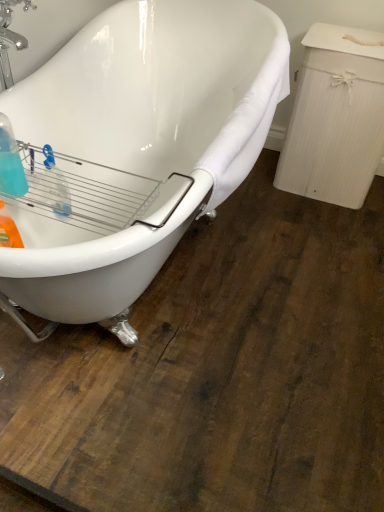
What do you see at coordinates (10, 161) in the screenshot? The image size is (384, 512). I see `translucent plastic bottle at left` at bounding box center [10, 161].

The height and width of the screenshot is (512, 384). What are the coordinates of `translucent plastic bottle at left` in the screenshot? It's located at (10, 161).

Measure the distance between point (24, 186) and camera.

Point (24, 186) is 3.46 feet away from camera.

Describe the element at coordinates (133, 150) in the screenshot. I see `white glossy bathtub at upper left` at that location.

Find the location of a particular element. The image size is (384, 512). white glossy bathtub at upper left is located at coordinates (133, 150).

At what (x,y) coordinates should I click in order to perform the action: click on translucent plastic bottle at left. Please return your answer as a coordinate pair (x, y). The image size is (384, 512). Looking at the image, I should click on pos(10,161).

Can you confirm if white glossy bathtub at upper left is positioned to the right of translucent plastic bottle at left?

Indeed, white glossy bathtub at upper left is positioned on the right side of translucent plastic bottle at left.

Which object is further away from the camera, white glossy bathtub at upper left or translucent plastic bottle at left?

translucent plastic bottle at left is further away from the camera.

Considering the points (188, 59) and (6, 157), which point is in front, point (188, 59) or point (6, 157)?

The point (6, 157) is closer.

From the image's perspective, which is below, white glossy bathtub at upper left or translucent plastic bottle at left?

translucent plastic bottle at left, from the image's perspective.

From a real-world perspective, relative to translucent plastic bottle at left, is white glossy bathtub at upper left vertically above or below?

In terms of real-world spatial position, white glossy bathtub at upper left is below translucent plastic bottle at left.

Is white glossy bathtub at upper left wider or thinner than translucent plastic bottle at left?

Clearly, white glossy bathtub at upper left has more width compared to translucent plastic bottle at left.

Looking at this image, which of these two, white glossy bathtub at upper left or translucent plastic bottle at left, stands taller?

white glossy bathtub at upper left is taller.

Is white glossy bathtub at upper left bigger than translucent plastic bottle at left?

Indeed, white glossy bathtub at upper left has a larger size compared to translucent plastic bottle at left.

Would you say white glossy bathtub at upper left is outside translucent plastic bottle at left?

Yes, white glossy bathtub at upper left is outside of translucent plastic bottle at left.

Are white glossy bathtub at upper left and translucent plastic bottle at left making contact?

There is a gap between white glossy bathtub at upper left and translucent plastic bottle at left.

Is white glossy bathtub at upper left positioned with its back to translucent plastic bottle at left?

Yes, white glossy bathtub at upper left is positioned with its back facing translucent plastic bottle at left.

How far apart are white glossy bathtub at upper left and translucent plastic bottle at left?

white glossy bathtub at upper left and translucent plastic bottle at left are 51.73 centimeters apart from each other.

At what (x,y) coordinates should I click in order to perform the action: click on bathtub on the right of translucent plastic bottle at left. Please return your answer as a coordinate pair (x, y). This screenshot has width=384, height=512. Looking at the image, I should click on (133, 150).

Is translucent plastic bottle at left at the left side of white glossy bathtub at upper left?

Yes, translucent plastic bottle at left is to the left of white glossy bathtub at upper left.

Who is more distant, translucent plastic bottle at left or white glossy bathtub at upper left?

translucent plastic bottle at left is further away from the camera.

Does point (0, 125) come behind point (129, 32)?

No.

From the image's perspective, between translucent plastic bottle at left and white glossy bathtub at upper left, which one is located above?

white glossy bathtub at upper left is shown above in the image.

From a real-world perspective, which object rests below the other?

From a 3D spatial view, white glossy bathtub at upper left is below.

Can you confirm if translucent plastic bottle at left is thinner than white glossy bathtub at upper left?

Yes.

Which of these two, translucent plastic bottle at left or white glossy bathtub at upper left, stands shorter?

translucent plastic bottle at left.

Between translucent plastic bottle at left and white glossy bathtub at upper left, which one has larger size?

white glossy bathtub at upper left is bigger.

Is translucent plastic bottle at left not within white glossy bathtub at upper left?

No.

Does translucent plastic bottle at left touch white glossy bathtub at upper left?

No, translucent plastic bottle at left is not beside white glossy bathtub at upper left.

Is translucent plastic bottle at left turned away from white glossy bathtub at upper left?

That's right, translucent plastic bottle at left is facing away from white glossy bathtub at upper left.

This screenshot has height=512, width=384. What are the coordinates of `cleaning product on the left of the white glossy bathtub at upper left` in the screenshot? It's located at (10, 161).

What are the coordinates of `cleaning product that appears on the left of white glossy bathtub at upper left` in the screenshot? It's located at (10, 161).

Where is `bathtub above the translucent plastic bottle at left (from the image's perspective)`? The height and width of the screenshot is (512, 384). bathtub above the translucent plastic bottle at left (from the image's perspective) is located at coordinates (133, 150).